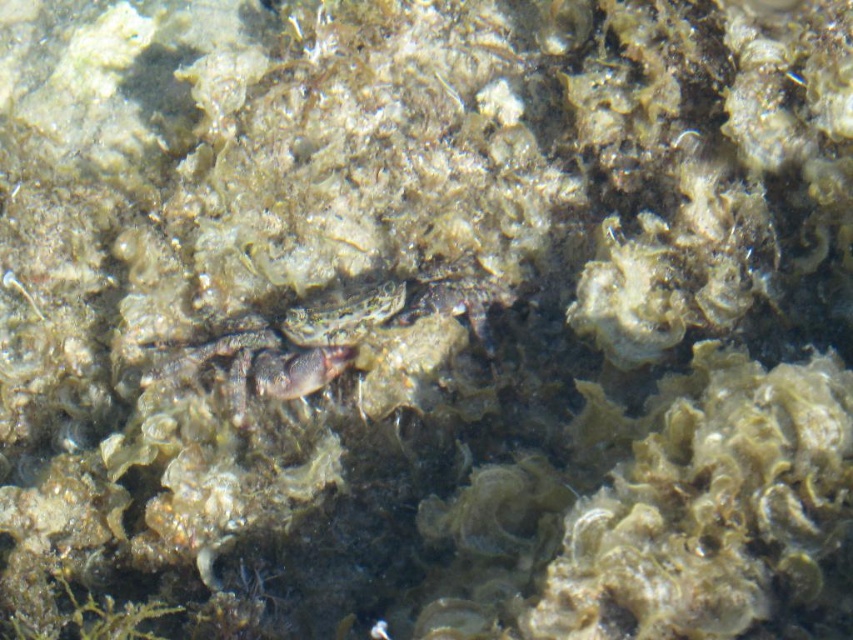
Question: Observing the image, what is the correct spatial positioning of translucent gray crab at center in reference to translucent greenish fish at center?

Choices:
 (A) below
 (B) above

Answer: (A)

Question: Which point is farther from the camera taking this photo?

Choices:
 (A) (334, 371)
 (B) (346, 314)

Answer: (A)

Question: Is translucent gray crab at center positioned before translucent greenish fish at center?

Choices:
 (A) no
 (B) yes

Answer: (B)

Question: Is translucent gray crab at center above translucent greenish fish at center?

Choices:
 (A) no
 (B) yes

Answer: (A)